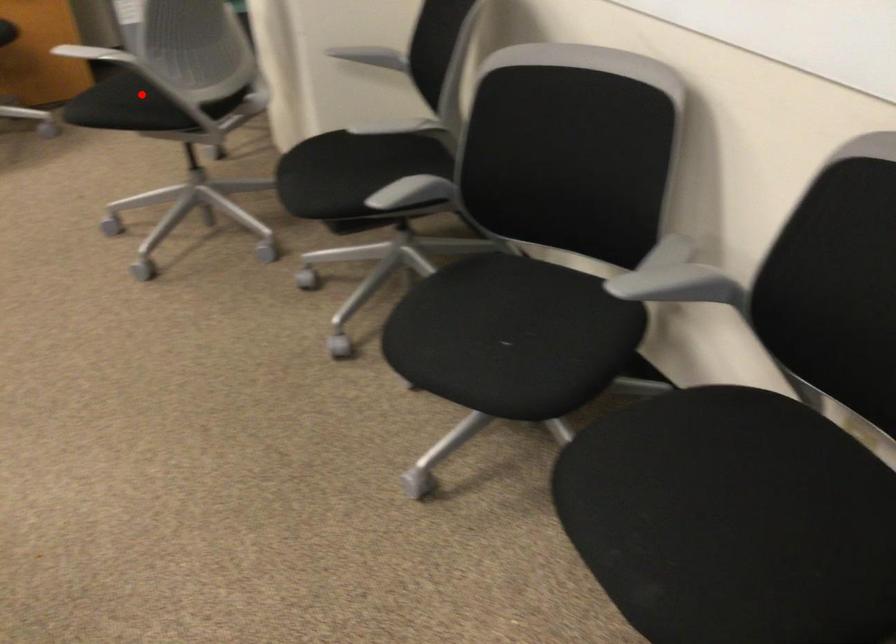
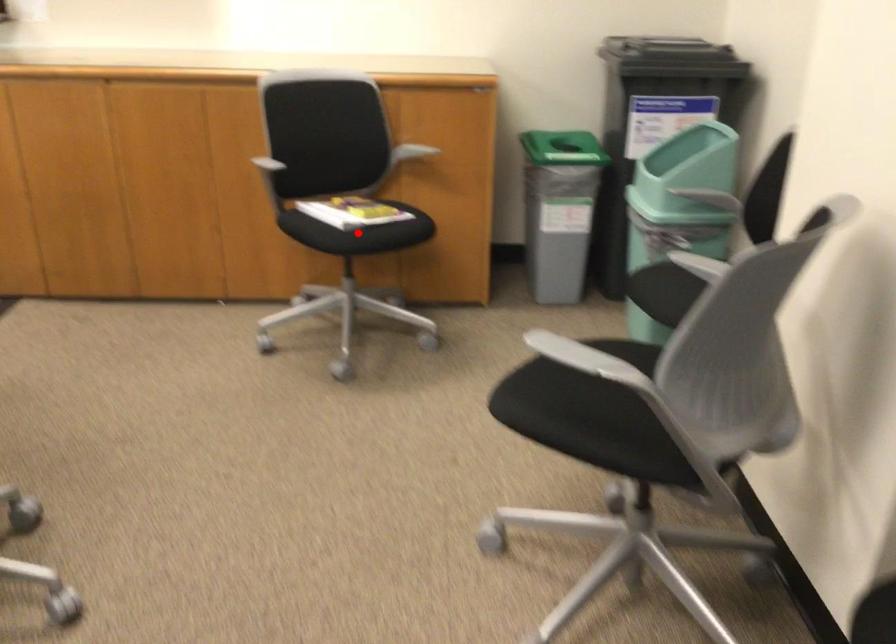
I am providing you with two images of the same scene from different viewpoints. A red point is marked on the first image and another point is marked on the second image. Do the highlighted points in image1 and image2 indicate the same real-world spot?

No